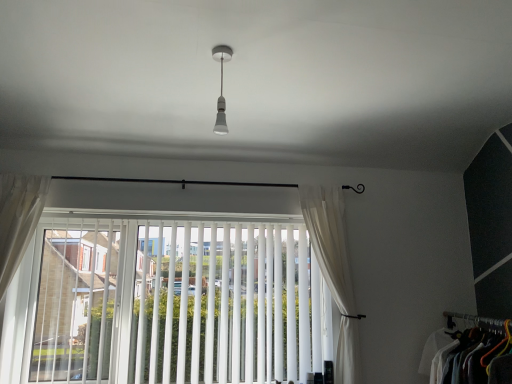
Question: Is matte white light bulb at center shorter than white sheer curtain at left, acting as the first curtain starting from the left?

Choices:
 (A) no
 (B) yes

Answer: (B)

Question: Does matte white light bulb at center have a greater width compared to white sheer curtain at left, which is the second curtain from right to left?

Choices:
 (A) no
 (B) yes

Answer: (A)

Question: Is matte white light bulb at center facing towards white sheer curtain at left, which is the second curtain from right to left?

Choices:
 (A) no
 (B) yes

Answer: (A)

Question: From a real-world perspective, is matte white light bulb at center below white sheer curtain at left, which is the second curtain from right to left?

Choices:
 (A) yes
 (B) no

Answer: (B)

Question: Is matte white light bulb at center closer to camera compared to white sheer curtain at left, which is the second curtain from right to left?

Choices:
 (A) yes
 (B) no

Answer: (A)

Question: Choose the correct answer: Is white sheer curtain at left, which is the second curtain from right to left, inside white fabric clothes at lower right or outside it?

Choices:
 (A) outside
 (B) inside

Answer: (A)

Question: Is white sheer curtain at left, which is the second curtain from right to left, wider or thinner than white fabric clothes at lower right?

Choices:
 (A) thin
 (B) wide

Answer: (A)

Question: Based on their positions, is white sheer curtain at left, which is the second curtain from right to left, located to the left or right of white fabric clothes at lower right?

Choices:
 (A) right
 (B) left

Answer: (B)

Question: Considering the positions of point (3, 213) and point (504, 332), is point (3, 213) closer or farther from the camera than point (504, 332)?

Choices:
 (A) farther
 (B) closer

Answer: (A)

Question: From a real-world perspective, relative to white vertical blinds at center, is white sheer curtain at right, arranged as the second curtain when viewed from the left, vertically above or below?

Choices:
 (A) below
 (B) above

Answer: (B)

Question: Would you say white sheer curtain at right, which appears as the first curtain when viewed from the right, is inside or outside white vertical blinds at center?

Choices:
 (A) outside
 (B) inside

Answer: (A)

Question: In terms of width, does white sheer curtain at right, which appears as the first curtain when viewed from the right, look wider or thinner when compared to white vertical blinds at center?

Choices:
 (A) thin
 (B) wide

Answer: (B)

Question: From the image's perspective, is white sheer curtain at right, which appears as the first curtain when viewed from the right, located above or below white vertical blinds at center?

Choices:
 (A) below
 (B) above

Answer: (B)

Question: Based on their positions, is white sheer curtain at left, acting as the first curtain starting from the left, located to the left or right of white vertical blinds at center?

Choices:
 (A) right
 (B) left

Answer: (B)

Question: In the image, is white sheer curtain at left, which is the second curtain from right to left, positioned in front of or behind white vertical blinds at center?

Choices:
 (A) behind
 (B) front

Answer: (B)